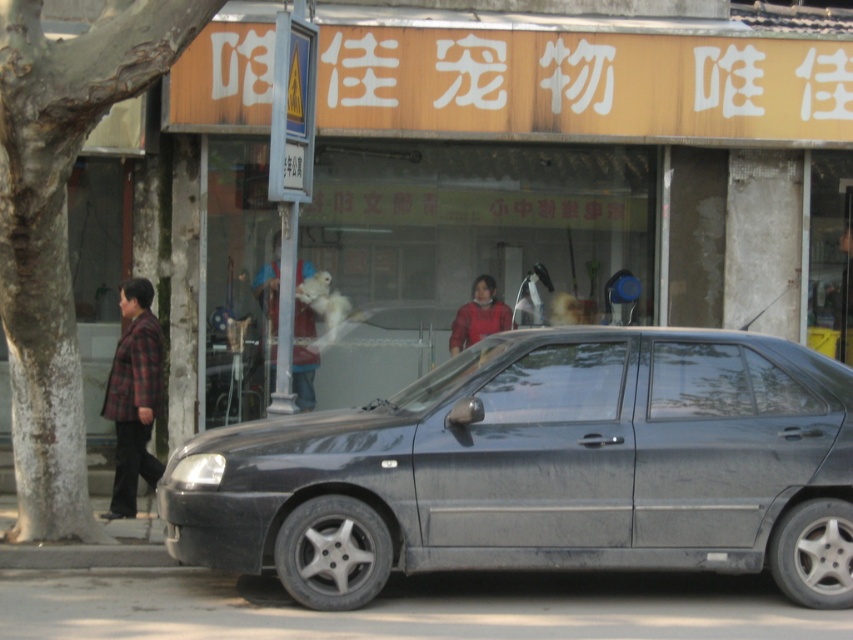
Between matte gray car at center and plaid fabric jacket at left, which one is positioned lower?

matte gray car at center is below.

Between point (775, 358) and point (141, 397), which one is positioned in front?

Point (775, 358)

Does point (531, 531) come closer to viewer compared to point (137, 426)?

Yes, point (531, 531) is in front of point (137, 426).

Find the location of a particular element. The height and width of the screenshot is (640, 853). matte gray car at center is located at coordinates pyautogui.click(x=541, y=468).

Does matte gray car at center appear over red matte jacket at center?

No, matte gray car at center is not above red matte jacket at center.

Can you confirm if matte gray car at center is bigger than red matte jacket at center?

Correct, matte gray car at center is larger in size than red matte jacket at center.

This screenshot has height=640, width=853. What do you see at coordinates (541, 468) in the screenshot?
I see `matte gray car at center` at bounding box center [541, 468].

Where is `matte gray car at center`? This screenshot has width=853, height=640. matte gray car at center is located at coordinates (541, 468).

Does point (142, 388) come behind point (465, 339)?

No, it is not.

Between plaid fabric jacket at left and red matte jacket at center, which one appears on the right side from the viewer's perspective?

red matte jacket at center

Between point (151, 400) and point (486, 324), which one is positioned behind?

The point (486, 324) is more distant.

You are a GUI agent. You are given a task and a screenshot of the screen. Output one action in this format:
    pyautogui.click(x=<x>, y=<y>)
    Task: Click on the plaid fabric jacket at left
    The image size is (853, 640).
    Given the screenshot: What is the action you would take?
    pyautogui.click(x=132, y=396)